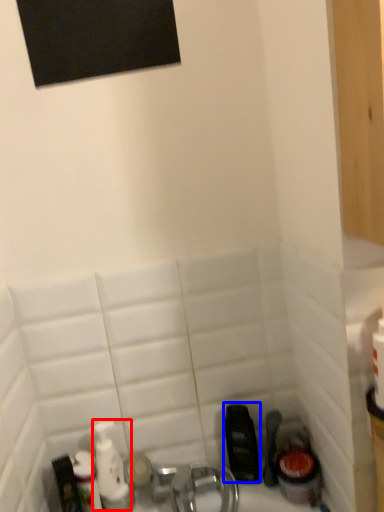
Question: Which object is further to the camera taking this photo, mouthwash (highlighted by a red box) or mouthwash (highlighted by a blue box)?

Choices:
 (A) mouthwash
 (B) mouthwash

Answer: (B)